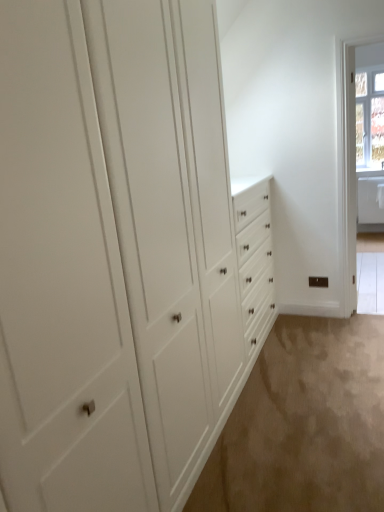
Question: Could you tell me if clear glass window at upper right is turned towards beige carpet at lower right?

Choices:
 (A) no
 (B) yes

Answer: (B)

Question: Is clear glass window at upper right oriented away from beige carpet at lower right?

Choices:
 (A) yes
 (B) no

Answer: (B)

Question: Is clear glass window at upper right further to the viewer compared to beige carpet at lower right?

Choices:
 (A) yes
 (B) no

Answer: (A)

Question: Does clear glass window at upper right have a greater width compared to beige carpet at lower right?

Choices:
 (A) no
 (B) yes

Answer: (A)

Question: Does clear glass window at upper right have a lesser width compared to beige carpet at lower right?

Choices:
 (A) yes
 (B) no

Answer: (A)

Question: Is the surface of clear glass window at upper right in direct contact with beige carpet at lower right?

Choices:
 (A) no
 (B) yes

Answer: (A)

Question: Is beige carpet at lower right positioned beyond the bounds of clear glass window at upper right?

Choices:
 (A) no
 (B) yes

Answer: (B)

Question: Is beige carpet at lower right further to camera compared to clear glass window at upper right?

Choices:
 (A) yes
 (B) no

Answer: (B)

Question: Does beige carpet at lower right appear on the right side of clear glass window at upper right?

Choices:
 (A) yes
 (B) no

Answer: (B)

Question: Is beige carpet at lower right shorter than clear glass window at upper right?

Choices:
 (A) no
 (B) yes

Answer: (B)

Question: From a real-world perspective, does beige carpet at lower right sit lower than clear glass window at upper right?

Choices:
 (A) yes
 (B) no

Answer: (A)

Question: Is beige carpet at lower right positioned in front of clear glass window at upper right?

Choices:
 (A) no
 (B) yes

Answer: (B)

Question: Does point (334, 441) appear closer or farther from the camera than point (372, 141)?

Choices:
 (A) closer
 (B) farther

Answer: (A)